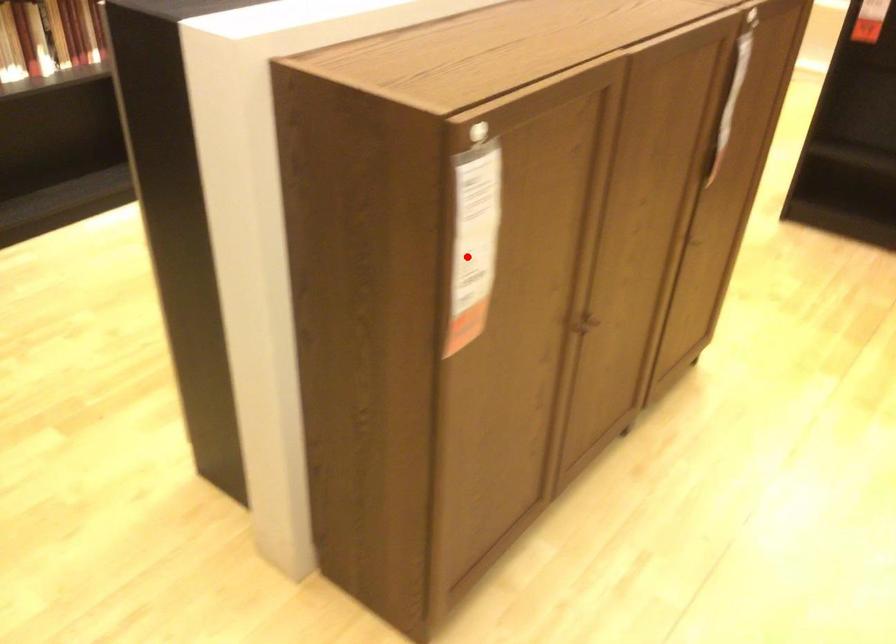
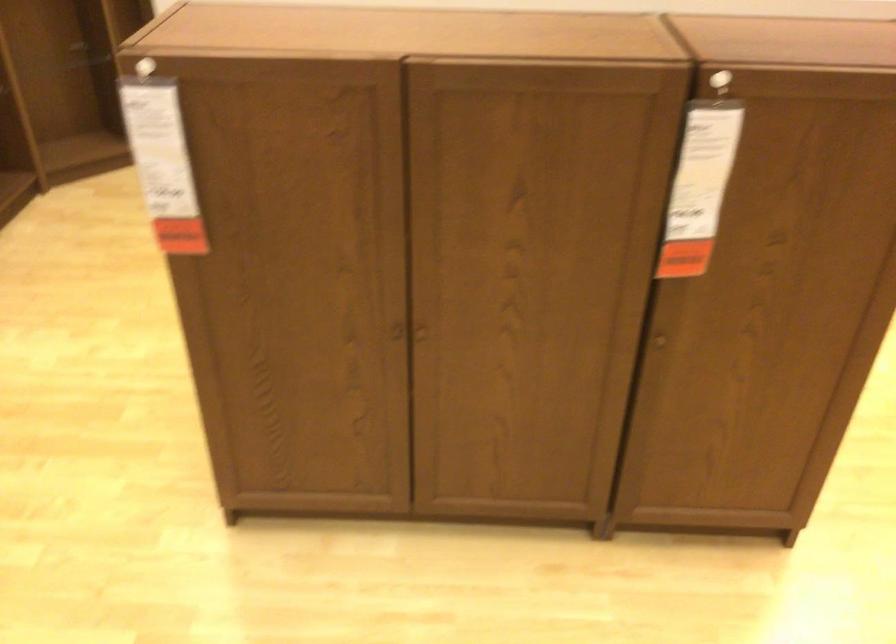
Locate, in the second image, the point that corresponds to the highlighted location in the first image.

(162, 164)